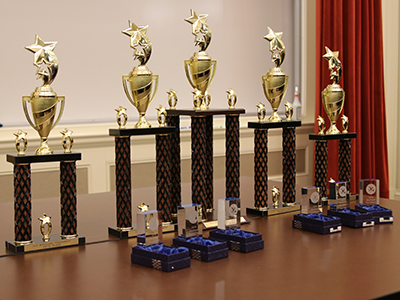
I want to click on brown table, so click(220, 282).